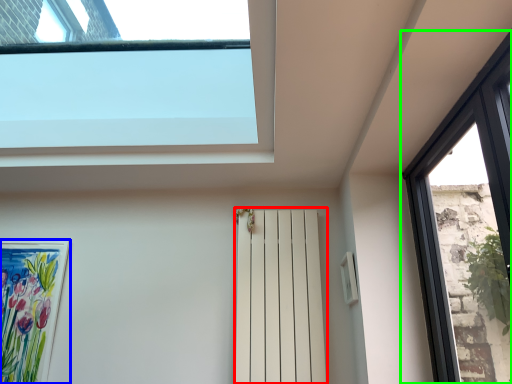
Question: Considering the real-world distances, which object is closest to shutter (highlighted by a red box)? picture frame (highlighted by a blue box) or window (highlighted by a green box).

Choices:
 (A) picture frame
 (B) window

Answer: (B)